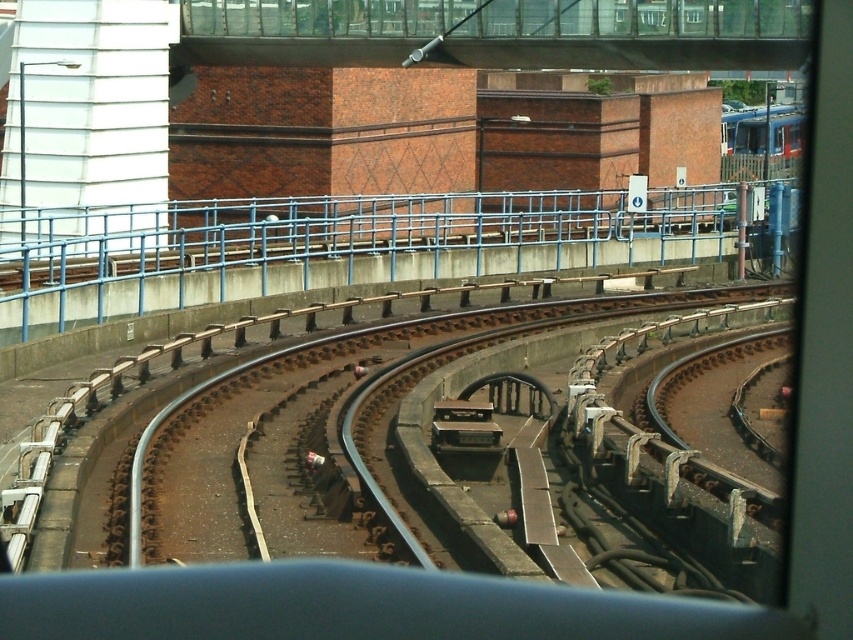
Question: Does blue metallic rail at upper center have a larger size compared to blue metallic train at upper right?

Choices:
 (A) yes
 (B) no

Answer: (A)

Question: Which point is closer to the camera taking this photo?

Choices:
 (A) (219, 236)
 (B) (790, 124)

Answer: (A)

Question: Which point is closer to the camera taking this photo?

Choices:
 (A) (78, 291)
 (B) (740, 124)

Answer: (A)

Question: Can you confirm if blue metallic rail at upper center is wider than blue metallic train at upper right?

Choices:
 (A) no
 (B) yes

Answer: (B)

Question: Which point is closer to the camera?

Choices:
 (A) blue metallic train at upper right
 (B) blue metallic rail at upper center

Answer: (B)

Question: Is blue metallic rail at upper center further to camera compared to blue metallic train at upper right?

Choices:
 (A) no
 (B) yes

Answer: (A)